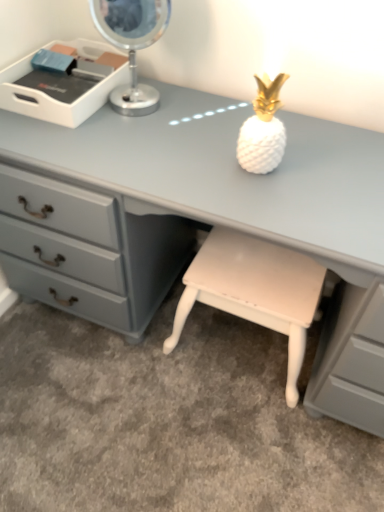
What do you see at coordinates (254, 290) in the screenshot? This screenshot has height=512, width=384. I see `white glossy stool at lower center` at bounding box center [254, 290].

The width and height of the screenshot is (384, 512). What do you see at coordinates (62, 84) in the screenshot?
I see `white plastic tray at upper left` at bounding box center [62, 84].

Identify the location of matte gray desk at center. This screenshot has height=512, width=384. (208, 221).

Identify the location of white glossy stool at lower center. The image size is (384, 512). (254, 290).

Is matte gray desk at center at the left side of white plastic tray at upper left?

Incorrect, matte gray desk at center is not on the left side of white plastic tray at upper left.

Is white plastic tray at upper left completely or partially inside matte gray desk at center?

No, white plastic tray at upper left is not inside matte gray desk at center.

Is matte gray desk at center turned away from white plastic tray at upper left?

No, matte gray desk at center is not facing the opposite direction of white plastic tray at upper left.

Which object is thinner, matte gray desk at center or white plastic tray at upper left?

Thinner between the two is white plastic tray at upper left.

The image size is (384, 512). Identify the location of writing desk above the white glossy stool at lower center (from a real-world perspective). (62, 84).

Does white plastic tray at upper left touch white glossy stool at lower center?

There is a gap between white plastic tray at upper left and white glossy stool at lower center.

Does white plastic tray at upper left come in front of white glossy stool at lower center?

Yes, the depth of white plastic tray at upper left is less than that of white glossy stool at lower center.

Is point (109, 60) farther from camera compared to point (265, 255)?

That is True.

Is metallic silver table lamp at upper left facing towards matte gray desk at center?

No, metallic silver table lamp at upper left is not aimed at matte gray desk at center.

How distant is metallic silver table lamp at upper left from matte gray desk at center?

metallic silver table lamp at upper left and matte gray desk at center are 15.09 inches apart.

I want to click on table lamp on the left of matte gray desk at center, so click(132, 45).

Which of these two, metallic silver table lamp at upper left or matte gray desk at center, stands shorter?

With less height is metallic silver table lamp at upper left.

Based on the photo, is white plastic tray at upper left to the left or to the right of metallic silver table lamp at upper left in the image?

Based on their positions, white plastic tray at upper left is located to the left of metallic silver table lamp at upper left.

Which of these two, white plastic tray at upper left or metallic silver table lamp at upper left, is smaller?

white plastic tray at upper left.

Consider the image. Is white plastic tray at upper left touching metallic silver table lamp at upper left?

No.

Considering the sizes of white glossy stool at lower center and white plastic tray at upper left in the image, is white glossy stool at lower center taller or shorter than white plastic tray at upper left?

white glossy stool at lower center is taller than white plastic tray at upper left.

Which is in front, white glossy stool at lower center or white plastic tray at upper left?

white plastic tray at upper left is closer to the camera.

From a real-world perspective, which object stands above the other?

white plastic tray at upper left.

Considering the relative sizes of white glossy stool at lower center and white plastic tray at upper left in the image provided, is white glossy stool at lower center thinner than white plastic tray at upper left?

Incorrect, the width of white glossy stool at lower center is not less than that of white plastic tray at upper left.

Between metallic silver table lamp at upper left and white plastic tray at upper left, which one appears on the left side from the viewer's perspective?

white plastic tray at upper left.

Considering the sizes of metallic silver table lamp at upper left and white plastic tray at upper left in the image, is metallic silver table lamp at upper left wider or thinner than white plastic tray at upper left?

In the image, metallic silver table lamp at upper left appears to be more narrow than white plastic tray at upper left.

Is metallic silver table lamp at upper left outside of white plastic tray at upper left?

metallic silver table lamp at upper left is positioned outside white plastic tray at upper left.

From the image's perspective, who appears lower, metallic silver table lamp at upper left or white plastic tray at upper left?

white plastic tray at upper left, from the image's perspective.

Based on the photo, from the image's perspective, is white plastic tray at upper left positioned above or below matte gray desk at center?

white plastic tray at upper left is above matte gray desk at center.

From a real-world perspective, which object stands above the other?

In real-world perspective, white plastic tray at upper left is above.

Is white plastic tray at upper left far from matte gray desk at center?

white plastic tray at upper left is near matte gray desk at center, not far away.

The height and width of the screenshot is (512, 384). I want to click on writing desk that appears on the left of matte gray desk at center, so click(62, 84).

This screenshot has width=384, height=512. I want to click on stool behind the white plastic tray at upper left, so click(254, 290).

Based on the photo, estimate the real-world distances between objects in this image. Which object is closer to metallic silver table lamp at upper left, white glossy stool at lower center or white plastic tray at upper left?

white plastic tray at upper left.

When comparing their distances from white glossy stool at lower center, does white plastic tray at upper left or matte gray desk at center seem closer?

matte gray desk at center.

From the image, which object appears to be nearer to white plastic tray at upper left, metallic silver table lamp at upper left or matte gray desk at center?

Based on the image, metallic silver table lamp at upper left appears to be nearer to white plastic tray at upper left.

Considering their positions, is white plastic tray at upper left positioned closer to matte gray desk at center than white glossy stool at lower center?

white glossy stool at lower center is positioned closer to the anchor matte gray desk at center.

Estimate the real-world distances between objects in this image. Which object is closer to metallic silver table lamp at upper left, matte gray desk at center or white glossy stool at lower center?

matte gray desk at center.

When comparing their distances from white glossy stool at lower center, does matte gray desk at center or metallic silver table lamp at upper left seem further?

Among the two, metallic silver table lamp at upper left is located further to white glossy stool at lower center.

Considering their positions, is matte gray desk at center positioned closer to metallic silver table lamp at upper left than white plastic tray at upper left?

Among the two, white plastic tray at upper left is located nearer to metallic silver table lamp at upper left.

When comparing their distances from white glossy stool at lower center, does metallic silver table lamp at upper left or white plastic tray at upper left seem closer?

Among the two, metallic silver table lamp at upper left is located nearer to white glossy stool at lower center.

You are a GUI agent. You are given a task and a screenshot of the screen. Output one action in this format:
    pyautogui.click(x=<x>, y=<y>)
    Task: Click on the writing desk between metallic silver table lamp at upper left and white glossy stool at lower center in the up-down direction
    
    Given the screenshot: What is the action you would take?
    pyautogui.click(x=62, y=84)

The image size is (384, 512). Identify the location of desk that lies between metallic silver table lamp at upper left and white glossy stool at lower center from top to bottom. (208, 221).

Where is `writing desk that lies between metallic silver table lamp at upper left and matte gray desk at center from top to bottom`? writing desk that lies between metallic silver table lamp at upper left and matte gray desk at center from top to bottom is located at coordinates (62, 84).

Where is `desk that lies between white plastic tray at upper left and white glossy stool at lower center from top to bottom`? desk that lies between white plastic tray at upper left and white glossy stool at lower center from top to bottom is located at coordinates (208, 221).